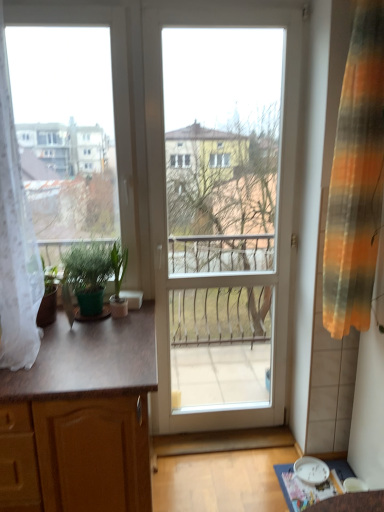
You are a GUI agent. You are given a task and a screenshot of the screen. Output one action in this format:
    pyautogui.click(x=<x>, y=<y>)
    Task: Click on the space that is in front of green matte plant at left, marked as the 2th houseplant in a right-to-left arrangement
    The width and height of the screenshot is (384, 512).
    Given the screenshot: What is the action you would take?
    pyautogui.click(x=93, y=336)